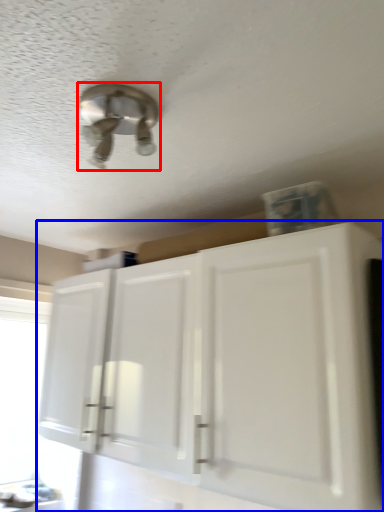
Question: Among these objects, which one is nearest to the camera, light fixture (highlighted by a red box) or cabinetry (highlighted by a blue box)?

Choices:
 (A) light fixture
 (B) cabinetry

Answer: (A)